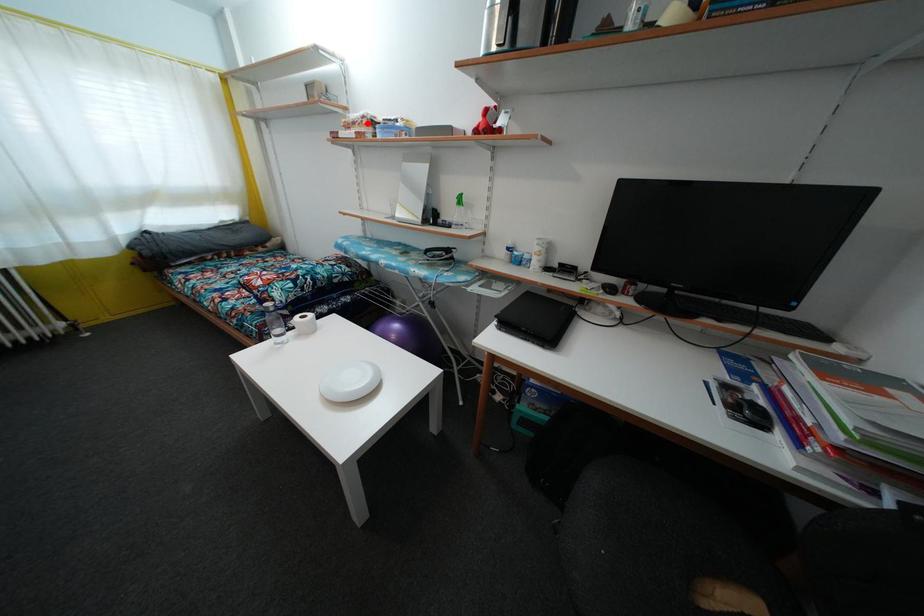
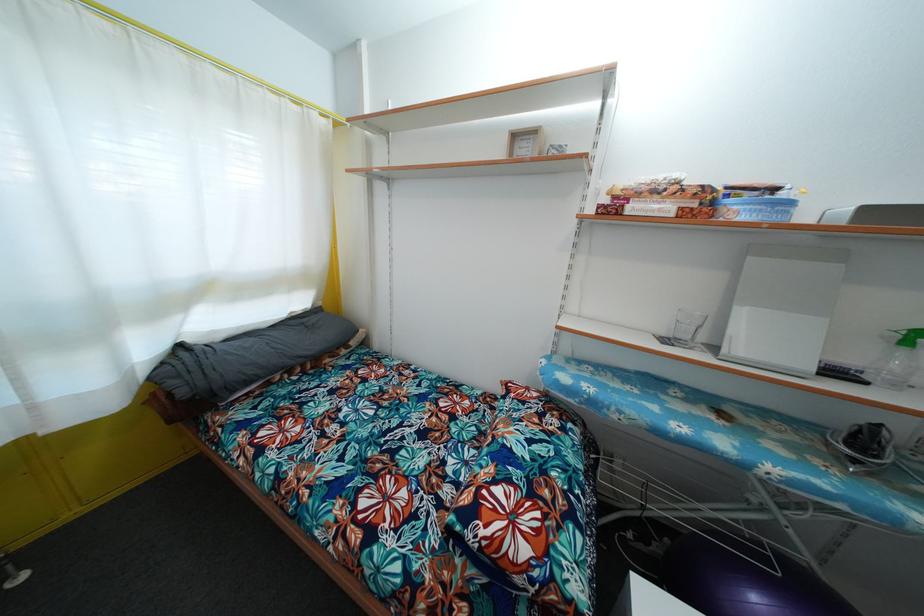
Find the pixel in the second image that matches the highlighted location in the first image.

(683, 188)